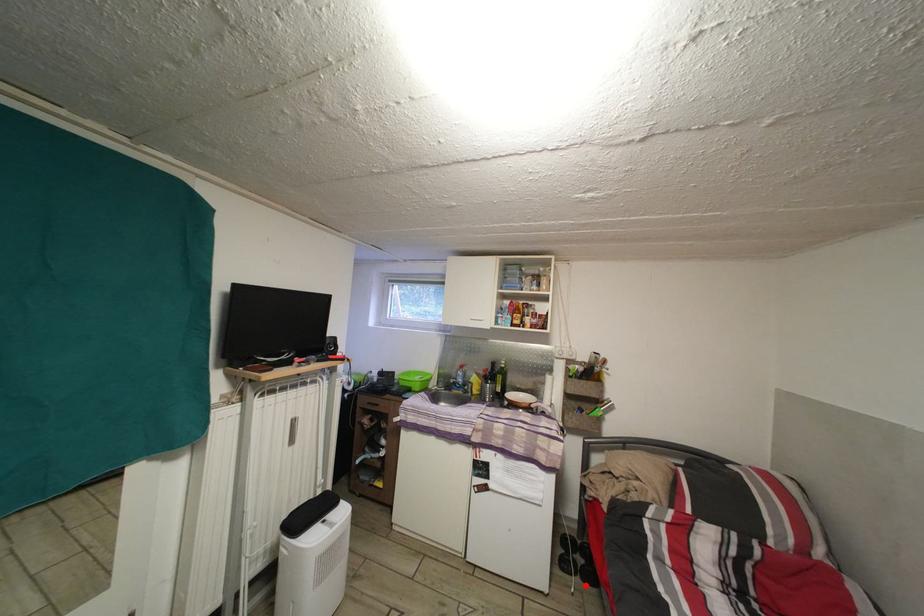
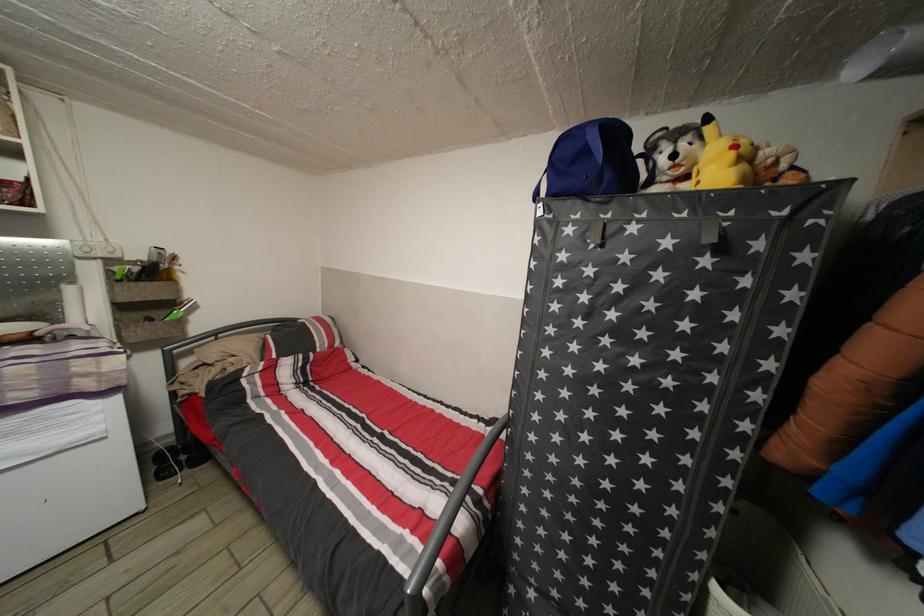
Question: I am providing you with two images of the same scene from different viewpoints. In image1, a red point is highlighted. Considering the same 3D point in image2, which of the following is correct?

Choices:
 (A) It is closer
 (B) It is farther

Answer: (A)